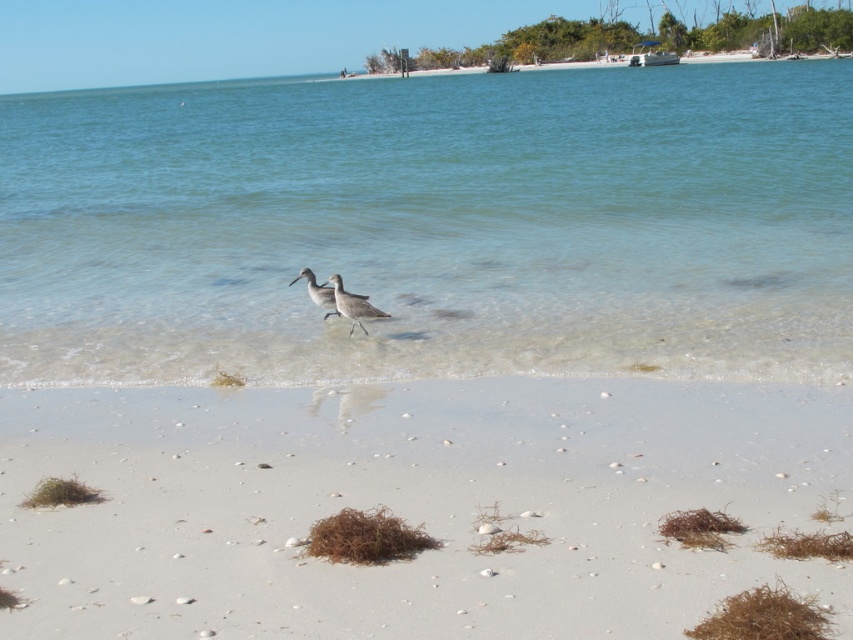
You are standing on the white sandy beach at lower center and want to reach the brown speckled sandpiper at center. Is the sandpiper closer to you or farther away?

The brown speckled sandpiper at center is farther away from you because the white sandy beach at lower center is in front of it, meaning the sandpiper is positioned behind the beach area where you are standing.